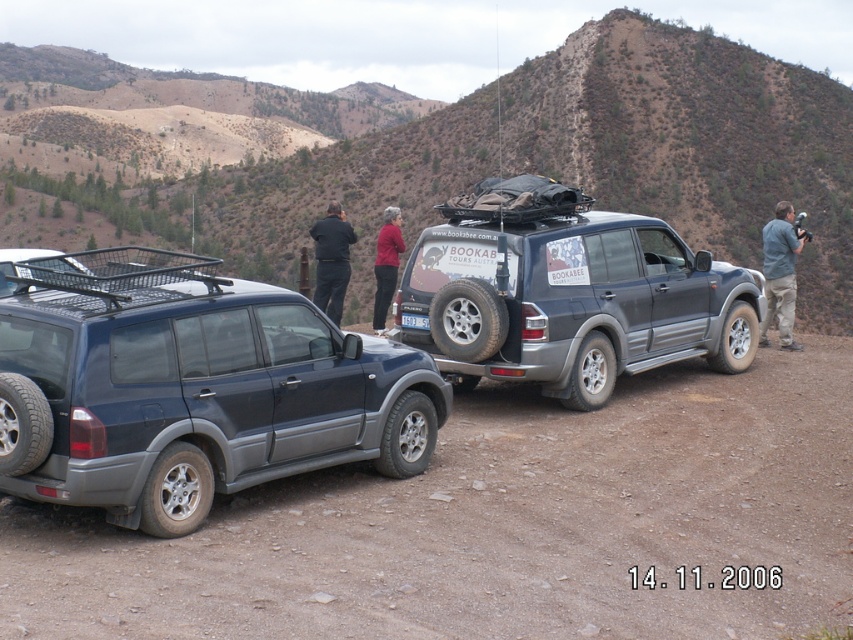
Does dirt track at center appear under blue fabric jacket at upper right?

Yes.

Does dirt track at center have a lesser width compared to blue fabric jacket at upper right?

Yes, dirt track at center is thinner than blue fabric jacket at upper right.

Locate an element on the screen. dirt track at center is located at coordinates (497, 525).

Which is more to the left, metallic gray suv at center-left or white plastic license plate at center?

metallic gray suv at center-left is more to the left.

Which is in front, point (103, 436) or point (405, 317)?

Point (103, 436) is in front.

The height and width of the screenshot is (640, 853). What are the coordinates of `metallic gray suv at center-left` in the screenshot? It's located at (190, 387).

Identify the location of metallic gray suv at center-left. (190, 387).

Who is higher up, blue fabric jacket at upper right or dark blue jeans at center?

Positioned higher is dark blue jeans at center.

Does point (788, 221) lie behind point (329, 260)?

No, it is not.

Where is `blue fabric jacket at upper right`? Image resolution: width=853 pixels, height=640 pixels. blue fabric jacket at upper right is located at coordinates (780, 273).